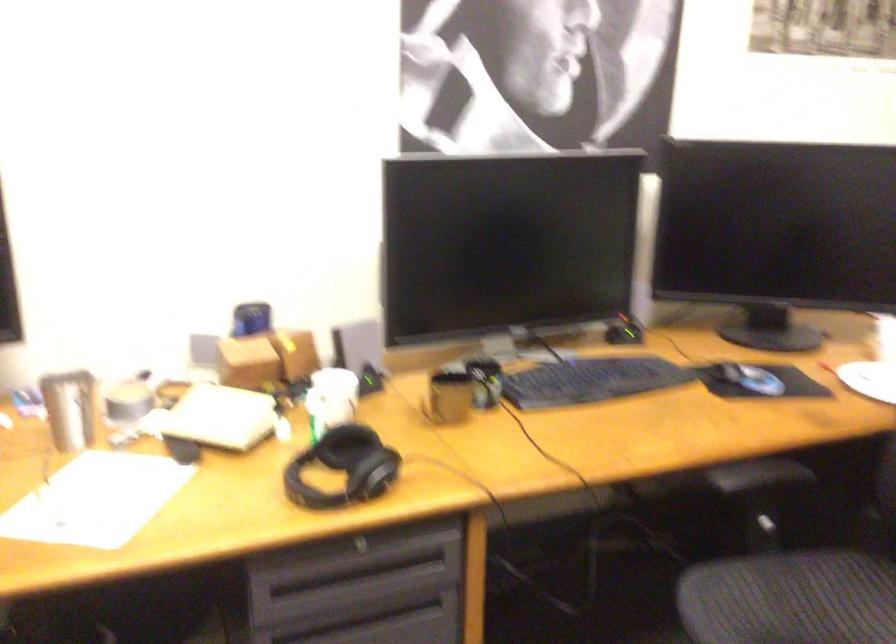
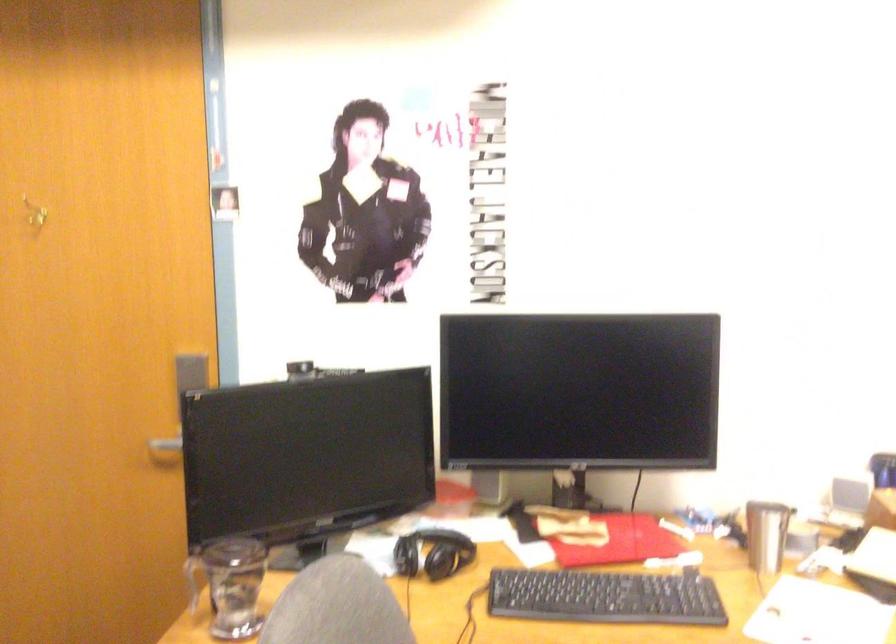
Which direction would the cameraman need to move to produce the second image?

The movement direction of the cameraman is left, backward.